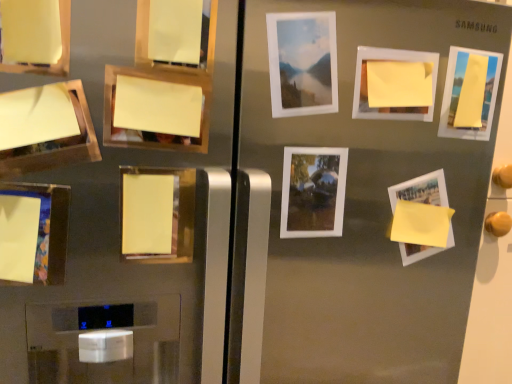
Question: Is matte white picture frame at upper center, placed as the seventh picture frame when sorted from left to right, at the right side of matte yellow paper at lower left, arranged as the 1th picture frame when viewed from the left?

Choices:
 (A) no
 (B) yes

Answer: (B)

Question: Is matte white picture frame at upper center, placed as the seventh picture frame when sorted from left to right, further to camera compared to matte yellow paper at lower left, arranged as the 1th picture frame when viewed from the left?

Choices:
 (A) yes
 (B) no

Answer: (A)

Question: Is matte white picture frame at upper center, placed as the seventh picture frame when sorted from left to right, wider than matte yellow paper at lower left, which appears as the 11th picture frame when viewed from the right?

Choices:
 (A) yes
 (B) no

Answer: (A)

Question: Can you confirm if matte white picture frame at upper center, which is counted as the 5th picture frame, starting from the right, is taller than matte yellow paper at lower left, which appears as the 11th picture frame when viewed from the right?

Choices:
 (A) yes
 (B) no

Answer: (A)

Question: Would you say matte yellow paper at lower left, which appears as the 11th picture frame when viewed from the right, is part of matte white picture frame at upper center, which is counted as the 5th picture frame, starting from the right,'s contents?

Choices:
 (A) no
 (B) yes

Answer: (A)

Question: Could you tell me if matte white picture frame at upper center, which is counted as the 5th picture frame, starting from the right, is turned towards matte yellow paper at lower left, which appears as the 11th picture frame when viewed from the right?

Choices:
 (A) yes
 (B) no

Answer: (B)

Question: Is white matte picture frame at upper center, the 6th picture frame from the left, wider than yellow paper at upper left, the 10th picture frame positioned from the right?

Choices:
 (A) yes
 (B) no

Answer: (B)

Question: From a real-world perspective, is white matte picture frame at upper center, the sixth picture frame viewed from the right, over yellow paper at upper left, which appears as the 2th picture frame when viewed from the left?

Choices:
 (A) no
 (B) yes

Answer: (B)

Question: From the image's perspective, would you say white matte picture frame at upper center, the 6th picture frame from the left, is positioned over yellow paper at upper left, the 10th picture frame positioned from the right?

Choices:
 (A) no
 (B) yes

Answer: (B)

Question: Is white matte picture frame at upper center, the 6th picture frame from the left, positioned with its back to yellow paper at upper left, the 10th picture frame positioned from the right?

Choices:
 (A) no
 (B) yes

Answer: (A)

Question: Is white matte picture frame at upper center, the 6th picture frame from the left, taller than yellow paper at upper left, the 10th picture frame positioned from the right?

Choices:
 (A) yes
 (B) no

Answer: (A)

Question: Does white matte picture frame at upper center, the sixth picture frame viewed from the right, appear on the right side of yellow paper at upper left, the 10th picture frame positioned from the right?

Choices:
 (A) no
 (B) yes

Answer: (B)

Question: Is matte yellow paper at upper left, the ninth picture frame from the right, thinner than yellow paper at upper left, which appears as the 2th picture frame when viewed from the left?

Choices:
 (A) no
 (B) yes

Answer: (B)